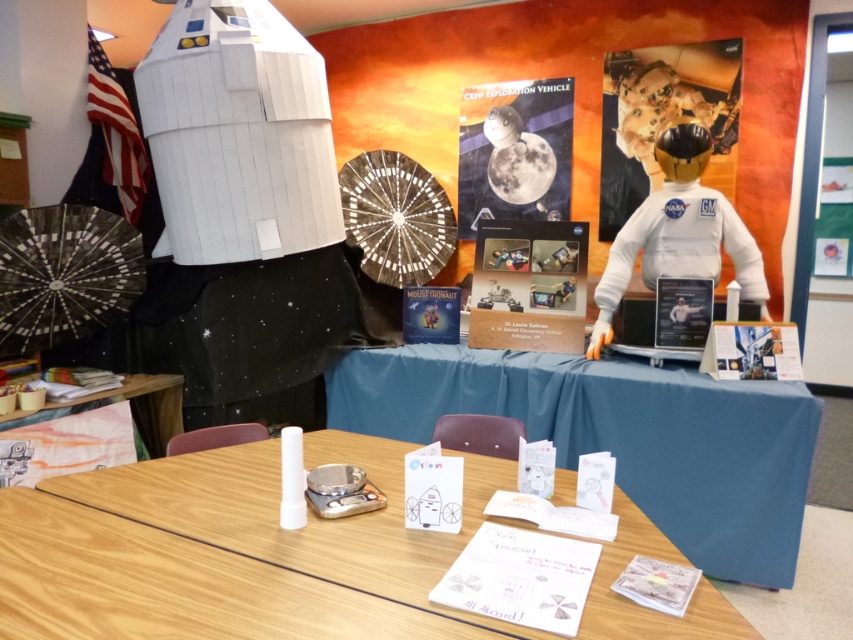
Measure the distance between point (700,618) and camera.

A distance of 3.93 feet exists between point (700,618) and camera.

Image resolution: width=853 pixels, height=640 pixels. What do you see at coordinates (308, 515) in the screenshot? I see `wooden table at center` at bounding box center [308, 515].

Where is `wooden table at center`? Image resolution: width=853 pixels, height=640 pixels. wooden table at center is located at coordinates (308, 515).

Is point (589, 349) positioned behind point (544, 102)?

No, (589, 349) is in front of (544, 102).

Can you confirm if white fabric astronaut at right is positioned to the right of matte paper poster at center?

Yes, white fabric astronaut at right is to the right of matte paper poster at center.

Image resolution: width=853 pixels, height=640 pixels. What are the coordinates of `white fabric astronaut at right` in the screenshot? It's located at (677, 230).

Is point (462, 364) farther from viewer compared to point (561, 470)?

Yes, it is.

This screenshot has height=640, width=853. Find the location of `white paper at center`. white paper at center is located at coordinates (619, 436).

This screenshot has width=853, height=640. What do you see at coordinates (619, 436) in the screenshot? I see `white paper at center` at bounding box center [619, 436].

Find the location of a particular element. Image resolution: width=853 pixels, height=640 pixels. white paper at center is located at coordinates (619, 436).